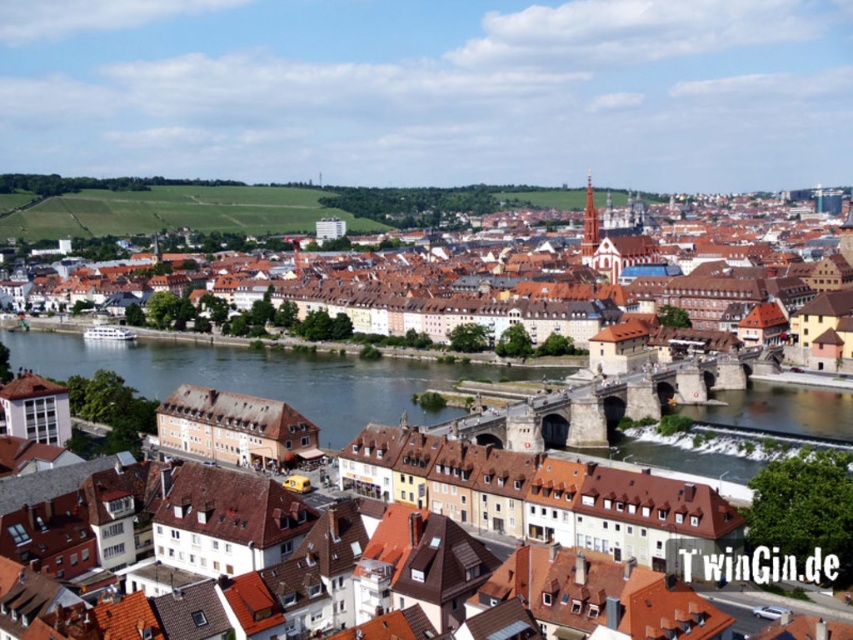
In the scene shown: You are standing at the point marked by the coordinates point (491, 296) in the image. What type of building are you facing?

The point 0.464, 0577 corresponds to the brown wooden townhouses at center, so you are facing the brown wooden townhouses at center.

You are standing on the left bank of the river and want to cross to the right bank. The blue water at center and the smooth concrete river at center are both in your path. Which one is taller and would require a higher jump to cross?

The blue water at center is taller than the smooth concrete river at center, so you would need a higher jump to cross the blue water at center.